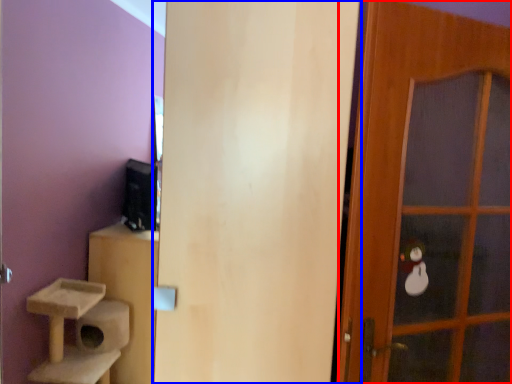
Question: Among these objects, which one is farthest to the camera, door (highlighted by a red box) or door (highlighted by a blue box)?

Choices:
 (A) door
 (B) door

Answer: (A)